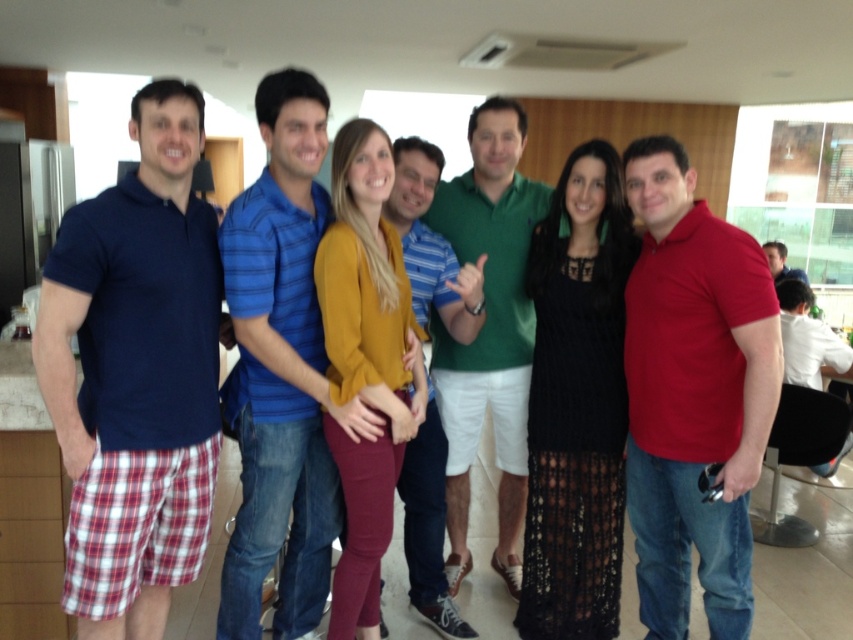
Question: Is red matte polo shirt at right thinner than striped cotton shirt at center?

Choices:
 (A) no
 (B) yes

Answer: (A)

Question: Can you confirm if striped cotton shirt at center is bigger than matte blue shirt at center?

Choices:
 (A) no
 (B) yes

Answer: (A)

Question: Which object is positioned farthest from the green cotton polo shirt at center?

Choices:
 (A) blue striped polo shirt at center
 (B) striped cotton shirt at center

Answer: (A)

Question: Does blue striped polo shirt at center appear over striped cotton shirt at center?

Choices:
 (A) no
 (B) yes

Answer: (B)

Question: Which point is farther to the camera?

Choices:
 (A) (776, 262)
 (B) (434, 483)

Answer: (A)

Question: Which point is farther to the camera?

Choices:
 (A) blue striped polo shirt at center
 (B) matte blue polo shirt at left
 (C) red matte polo shirt at right

Answer: (A)